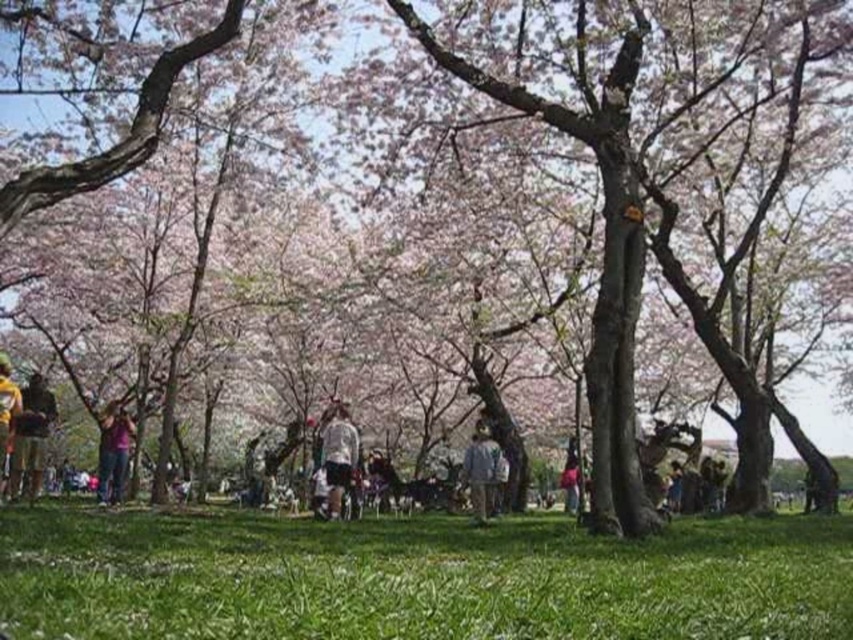
You are a photographer standing in the park and want to capture a closeup of the white matte shirt at center. Given that you are currently 99.91 meters away from it, can you take a clear photo without moving closer?

The white matte shirt at center is 99.91 meters away from camera, so it would be difficult to capture a clear closeup without moving closer as the distance is too far for most cameras to focus effectively.

You are a park visitor who wants to pick up the light gray fabric jacket at center. However, you are currently standing next to the yellow fabric bag at lower left. Based on the scene, can you tell me whether the jacket is located above or below the bag?

The light gray fabric jacket at center is below the yellow fabric bag at lower left, so the jacket is located below the bag.